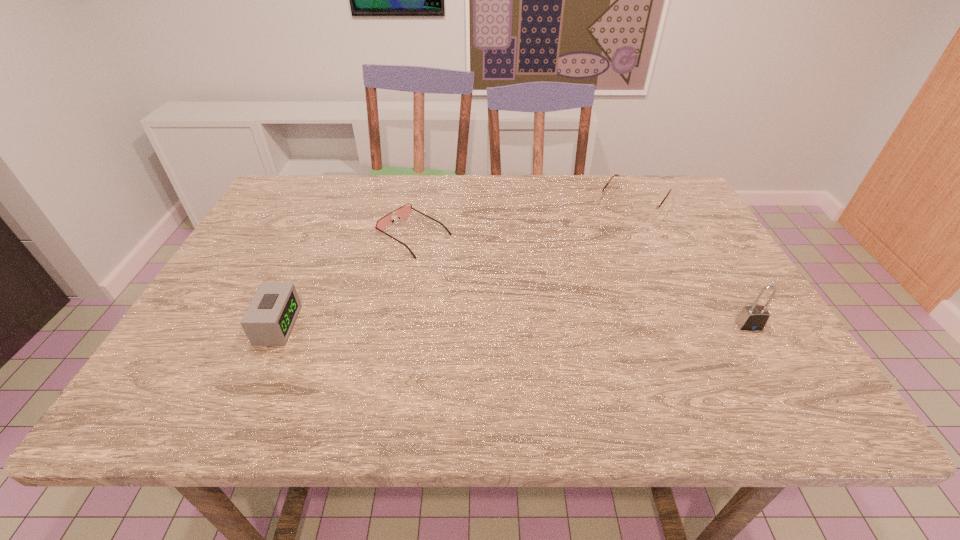
The image size is (960, 540). In order to click on object that is at the far right corner in this screenshot , I will do `click(640, 210)`.

In the image, there is a desktop. Where is `vacant space at the far edge`? The image size is (960, 540). vacant space at the far edge is located at coordinates (604, 210).

In the image, there is a desktop. What are the coordinates of `vacant space at the near edge` in the screenshot? It's located at (552, 341).

At what (x,y) coordinates should I click in order to perform the action: click on free space at the left edge of the desktop. Please return your answer as a coordinate pair (x, y). The image size is (960, 540). Looking at the image, I should click on (242, 332).

Where is `vacant space at the right edge of the desktop`? The width and height of the screenshot is (960, 540). vacant space at the right edge of the desktop is located at coordinates (716, 266).

Find the location of `free space at the far left corner`. free space at the far left corner is located at coordinates (299, 183).

The image size is (960, 540). Identify the location of free region at the near left corner. [x=184, y=349].

You are a GUI agent. You are given a task and a screenshot of the screen. Output one action in this format:
    pyautogui.click(x=<x>, y=<y>)
    Task: Click on the free space at the far right corner
    The width and height of the screenshot is (960, 540).
    Given the screenshot: What is the action you would take?
    pyautogui.click(x=652, y=176)

At what (x,y) coordinates should I click in order to perform the action: click on empty space that is in between the leftmost object and the second object from left to right. Please return your answer as a coordinate pair (x, y). Looking at the image, I should click on (346, 280).

The image size is (960, 540). Identify the location of free space between the padlock and the spectacles. (691, 264).